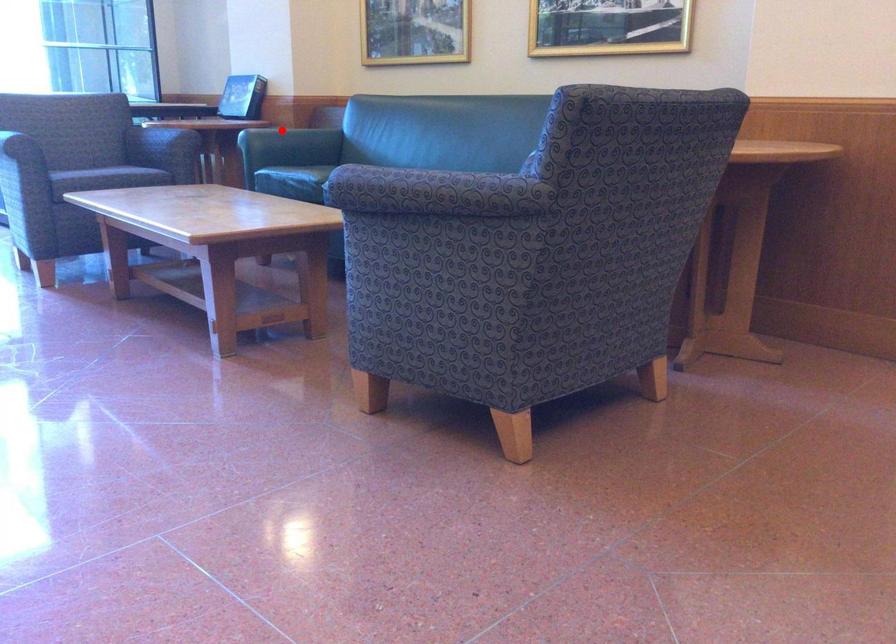
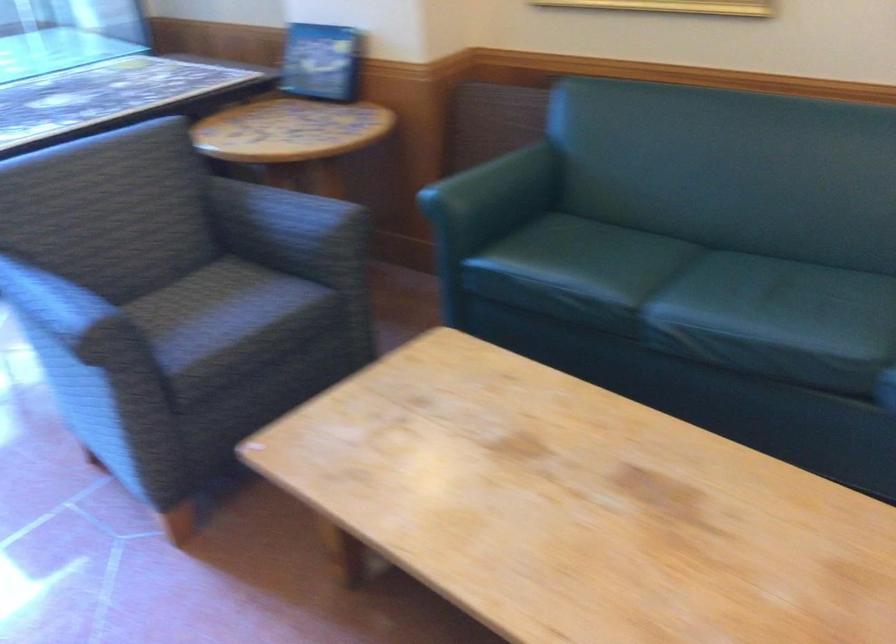
Where in the second image is the point corresponding to the highlighted location from the first image?

(496, 182)